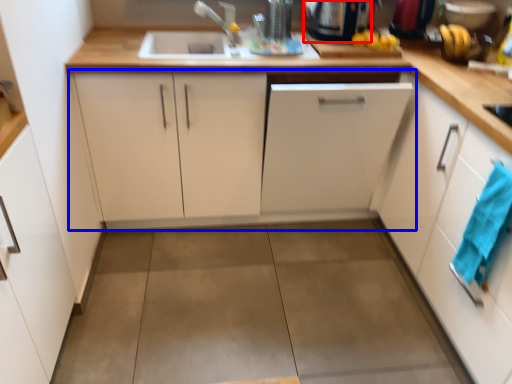
Question: Which object appears farthest to the camera in this image, appliance (highlighted by a red box) or cabinetry (highlighted by a blue box)?

Choices:
 (A) appliance
 (B) cabinetry

Answer: (A)